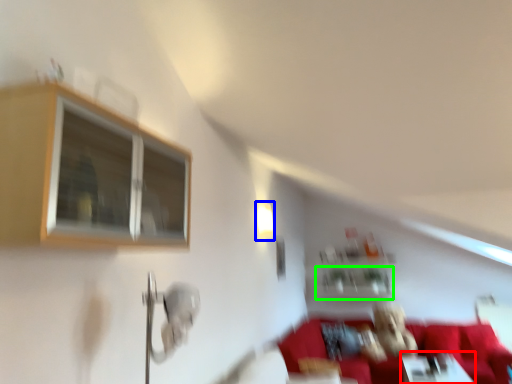
Question: Which object is the farthest from table (highlighted by a red box)? Choose among these: light fixture (highlighted by a blue box) or shelf (highlighted by a green box).

Choices:
 (A) light fixture
 (B) shelf

Answer: (A)